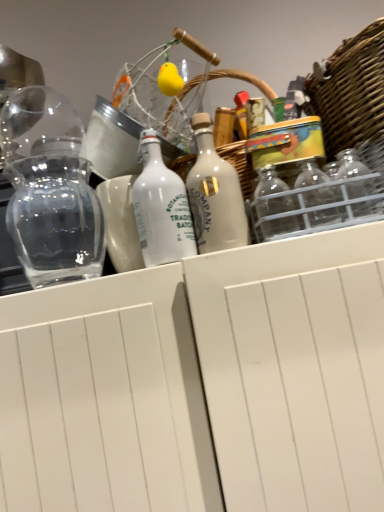
Question: Considering the relative sizes of woven wicker basket at upper right and transparent glass vase at left in the image provided, is woven wicker basket at upper right taller than transparent glass vase at left?

Choices:
 (A) no
 (B) yes

Answer: (A)

Question: Is woven wicker basket at upper right aimed at transparent glass vase at left?

Choices:
 (A) yes
 (B) no

Answer: (B)

Question: Is woven wicker basket at upper right oriented away from transparent glass vase at left?

Choices:
 (A) no
 (B) yes

Answer: (A)

Question: Does woven wicker basket at upper right come in front of transparent glass vase at left?

Choices:
 (A) yes
 (B) no

Answer: (A)

Question: Is woven wicker basket at upper right at the left side of transparent glass vase at left?

Choices:
 (A) yes
 (B) no

Answer: (B)

Question: From the image's perspective, does woven wicker basket at upper right appear higher than transparent glass vase at left?

Choices:
 (A) no
 (B) yes

Answer: (B)

Question: Is white matte bottle at center, positioned as the 2th bottle in right-to-left order, looking in the opposite direction of transparent glass vase at left?

Choices:
 (A) yes
 (B) no

Answer: (B)

Question: Does white matte bottle at center, positioned as the 2th bottle in right-to-left order, appear on the left side of transparent glass vase at left?

Choices:
 (A) yes
 (B) no

Answer: (B)

Question: Is there a large distance between white matte bottle at center, which is the 1th bottle in left-to-right order, and transparent glass vase at left?

Choices:
 (A) yes
 (B) no

Answer: (B)

Question: Is white matte bottle at center, positioned as the 2th bottle in right-to-left order, smaller than transparent glass vase at left?

Choices:
 (A) yes
 (B) no

Answer: (A)

Question: Could transparent glass vase at left be considered to be inside white matte bottle at center, which is the 1th bottle in left-to-right order?

Choices:
 (A) no
 (B) yes

Answer: (A)

Question: Is white matte bottle at center, positioned as the 2th bottle in right-to-left order, to the right of transparent glass vase at left from the viewer's perspective?

Choices:
 (A) yes
 (B) no

Answer: (A)

Question: Is woven wicker basket at upper right thinner than white matte bottle at center, positioned as the 2th bottle in right-to-left order?

Choices:
 (A) yes
 (B) no

Answer: (B)